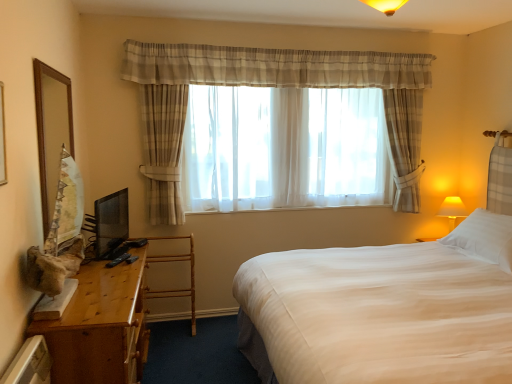
Question: From the image's perspective, does sheer fabric bay window at center appear lower than wooden desk at left?

Choices:
 (A) no
 (B) yes

Answer: (A)

Question: Is sheer fabric bay window at center oriented towards wooden desk at left?

Choices:
 (A) yes
 (B) no

Answer: (B)

Question: Considering the relative sizes of sheer fabric bay window at center and wooden desk at left in the image provided, is sheer fabric bay window at center taller than wooden desk at left?

Choices:
 (A) no
 (B) yes

Answer: (B)

Question: Can you confirm if sheer fabric bay window at center is smaller than wooden desk at left?

Choices:
 (A) no
 (B) yes

Answer: (B)

Question: Considering the relative sizes of sheer fabric bay window at center and wooden desk at left in the image provided, is sheer fabric bay window at center wider than wooden desk at left?

Choices:
 (A) yes
 (B) no

Answer: (B)

Question: From the image's perspective, relative to white soft pillow at upper right, is wooden desk at left above or below?

Choices:
 (A) below
 (B) above

Answer: (A)

Question: Based on their sizes in the image, would you say wooden desk at left is bigger or smaller than white soft pillow at upper right?

Choices:
 (A) small
 (B) big

Answer: (B)

Question: From a real-world perspective, relative to white soft pillow at upper right, is wooden desk at left vertically above or below?

Choices:
 (A) above
 (B) below

Answer: (B)

Question: Is wooden desk at left wider or thinner than white soft pillow at upper right?

Choices:
 (A) wide
 (B) thin

Answer: (B)

Question: Looking at the image, does wooden desk at left seem bigger or smaller compared to white plastic radiator at lower left?

Choices:
 (A) big
 (B) small

Answer: (A)

Question: From the image's perspective, is wooden desk at left above or below white plastic radiator at lower left?

Choices:
 (A) above
 (B) below

Answer: (B)

Question: Considering the positions of wooden desk at left and white plastic radiator at lower left in the image, is wooden desk at left wider or thinner than white plastic radiator at lower left?

Choices:
 (A) thin
 (B) wide

Answer: (B)

Question: Considering their positions, is wooden desk at left located in front of or behind white plastic radiator at lower left?

Choices:
 (A) behind
 (B) front

Answer: (A)

Question: From the image's perspective, relative to sheer white curtain at center, is wooden desk at left above or below?

Choices:
 (A) below
 (B) above

Answer: (A)

Question: Visually, is wooden desk at left positioned to the left or to the right of sheer white curtain at center?

Choices:
 (A) left
 (B) right

Answer: (A)